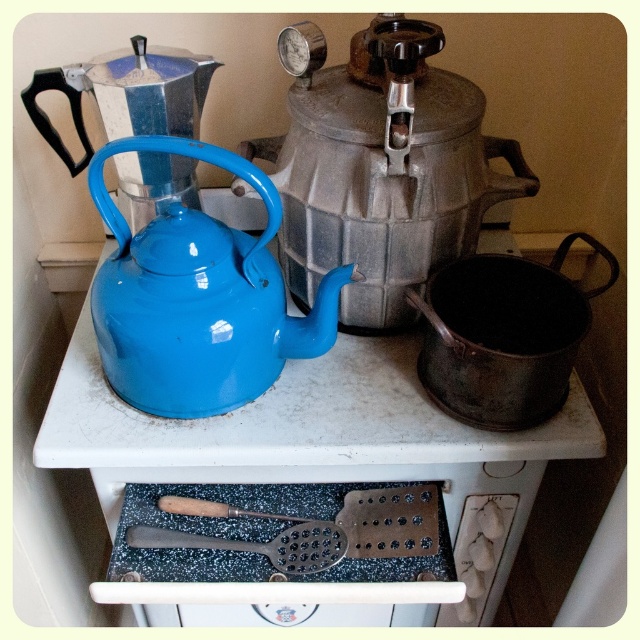
Question: Which of the following is the closest to the observer?

Choices:
 (A) wooden-handled metal spatula at lower center
 (B) matte enamel teapot at center

Answer: (B)

Question: Which point is closer to the camera?

Choices:
 (A) blue enamel kettle at upper left
 (B) wooden-handled metal spatula at lower center
 (C) metallic silver teapot at center

Answer: (C)

Question: Can you confirm if metallic silver teapot at center is thinner than matte enamel teapot at center?

Choices:
 (A) no
 (B) yes

Answer: (A)

Question: Is metallic silver teapot at center thinner than matte enamel teapot at center?

Choices:
 (A) no
 (B) yes

Answer: (A)

Question: Considering the real-world distances, which object is farthest from the metallic silver teapot at center?

Choices:
 (A) matte enamel teapot at center
 (B) wooden-handled metal spatula at lower center

Answer: (B)

Question: Is matte enamel teapot at center further to the viewer compared to wooden-handled metal spatula at lower center?

Choices:
 (A) no
 (B) yes

Answer: (A)